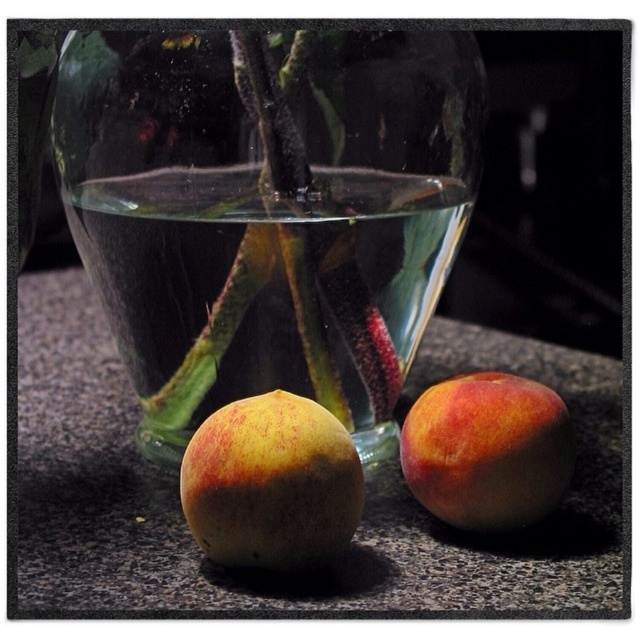
You are arranging fruits on a countertop and see the smooth granite surface at center and the ripe peach at center. Which object is positioned higher from the ground?

The smooth granite surface at center is located above the ripe peach at center, so it is positioned higher from the ground.

You are arranging fruits on a countertop and have a ripe yellow peach at center. You want to place it on the smooth granite surface at center. Considering the sizes, will the peach fit entirely on the surface?

The smooth granite surface at center is wider than the ripe yellow peach at center, so the peach will fit entirely on the surface.

You are arranging fruits on a countertop and want to place a ripe yellow peach at center on top of the smooth granite surface at center. Will the peach be visible from above the surface?

The smooth granite surface at center is taller than ripe yellow peach at center, so the peach will be partially or fully hidden by the surface when viewed from above.